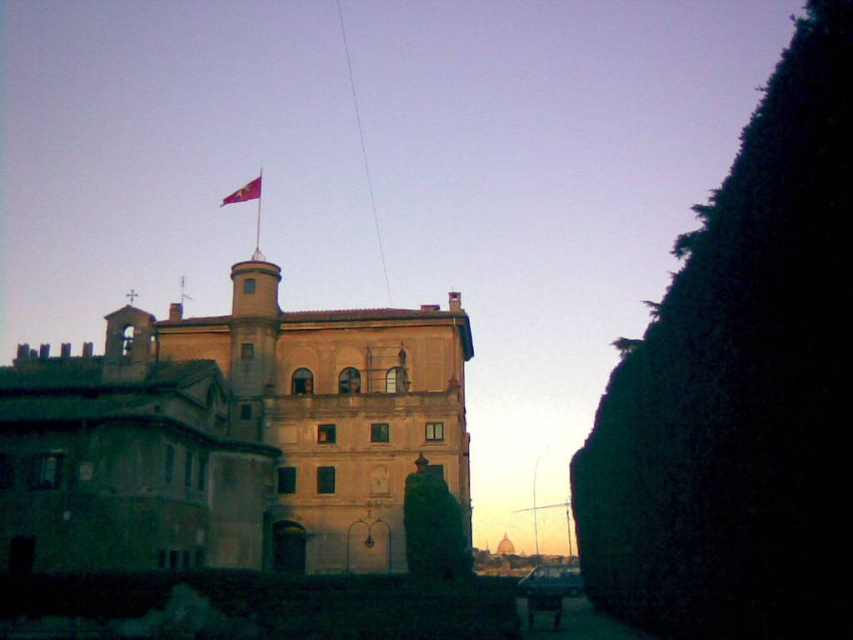
Does beige stone palace at center appear on the left side of red fabric flag at top center?

Incorrect, beige stone palace at center is not on the left side of red fabric flag at top center.

Between beige stone palace at center and red fabric flag at top center, which one has less height?

Standing shorter between the two is red fabric flag at top center.

Between point (167, 474) and point (259, 189), which one is positioned in front?

Positioned in front is point (167, 474).

The width and height of the screenshot is (853, 640). I want to click on beige stone palace at center, so click(233, 436).